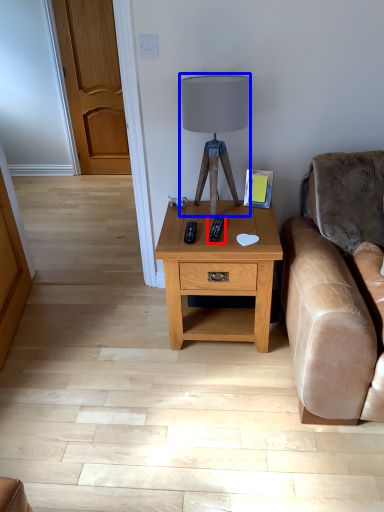
Question: Which of the following is the closest to the observer, remote (highlighted by a red box) or table lamp (highlighted by a blue box)?

Choices:
 (A) remote
 (B) table lamp

Answer: (B)